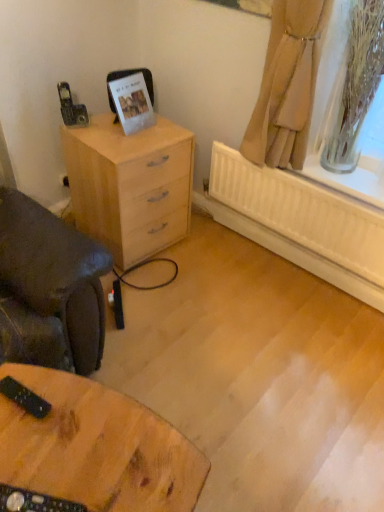
Image resolution: width=384 pixels, height=512 pixels. Describe the element at coordinates (287, 85) in the screenshot. I see `beige fabric curtain at upper right` at that location.

Identify the location of beige fabric curtain at upper right. (287, 85).

Considering the sizes of objects wooden table at lower left and beige fabric curtain at upper right in the image provided, who is bigger, wooden table at lower left or beige fabric curtain at upper right?

Bigger between the two is wooden table at lower left.

Could you tell me if wooden table at lower left is facing beige fabric curtain at upper right?

Answer: No, wooden table at lower left is not oriented towards beige fabric curtain at upper right.

Is wooden table at lower left with beige fabric curtain at upper right?

A: wooden table at lower left and beige fabric curtain at upper right are not in contact.

Between wooden table at lower left and light wood chest of drawers at left, which one has larger width?

wooden table at lower left.

Does wooden table at lower left turn towards light wood chest of drawers at left?

No, wooden table at lower left is not aimed at light wood chest of drawers at left.

From a real-world perspective, relative to light wood chest of drawers at left, is wooden table at lower left vertically above or below?

wooden table at lower left is situated lower than light wood chest of drawers at left in the real world.

Is point (129, 238) in front of point (269, 147)?

No, it is not.

Which object is closer to the camera taking this photo, light wood chest of drawers at left or beige fabric curtain at upper right?

beige fabric curtain at upper right.

Between light wood chest of drawers at left and beige fabric curtain at upper right, which one appears on the left side from the viewer's perspective?

light wood chest of drawers at left is more to the left.

Image resolution: width=384 pixels, height=512 pixels. In the image, there is a beige fabric curtain at upper right. In order to click on the chest of drawers below it (from the image's perspective) in this screenshot , I will do `click(130, 185)`.

From a real-world perspective, is beige fabric curtain at upper right above or below wooden table at lower left?

In terms of real-world spatial position, beige fabric curtain at upper right is above wooden table at lower left.

From the image's perspective, between beige fabric curtain at upper right and wooden table at lower left, which one is located above?

beige fabric curtain at upper right.

How many degrees apart are the facing directions of beige fabric curtain at upper right and wooden table at lower left?

They differ by 74.7 degrees in their facing directions.

Considering the relative sizes of beige fabric curtain at upper right and wooden table at lower left in the image provided, is beige fabric curtain at upper right wider than wooden table at lower left?

No, beige fabric curtain at upper right is not wider than wooden table at lower left.

Is light wood chest of drawers at left shorter than wooden table at lower left?

Incorrect, the height of light wood chest of drawers at left does not fall short of that of wooden table at lower left.

Consider the image. From a real-world perspective, who is located lower, light wood chest of drawers at left or wooden table at lower left?

In real-world perspective, wooden table at lower left is lower.

Which object is more forward, light wood chest of drawers at left or wooden table at lower left?

wooden table at lower left is in front.

Considering the relative positions of beige fabric curtain at upper right and light wood chest of drawers at left in the image provided, is beige fabric curtain at upper right in front of light wood chest of drawers at left?

Yes, beige fabric curtain at upper right is closer to the viewer.

Find the location of a particular element. curtain above the light wood chest of drawers at left (from a real-world perspective) is located at coordinates (x=287, y=85).

Does beige fabric curtain at upper right have a lesser width compared to light wood chest of drawers at left?

Indeed, beige fabric curtain at upper right has a lesser width compared to light wood chest of drawers at left.

From the image's perspective, is beige fabric curtain at upper right positioned above or below light wood chest of drawers at left?

Based on their image positions, beige fabric curtain at upper right is located above light wood chest of drawers at left.

The height and width of the screenshot is (512, 384). I want to click on curtain above the wooden table at lower left (from a real-world perspective), so click(287, 85).

The height and width of the screenshot is (512, 384). What are the coordinates of `table in front of the light wood chest of drawers at left` in the screenshot? It's located at (96, 447).

Considering their positions, is light wood chest of drawers at left positioned closer to beige fabric curtain at upper right than wooden table at lower left?

light wood chest of drawers at left is positioned closer to the anchor beige fabric curtain at upper right.

From the image, which object appears to be farther from beige fabric curtain at upper right, wooden table at lower left or light wood chest of drawers at left?

→ wooden table at lower left lies further to beige fabric curtain at upper right than the other object.

In the scene shown: Looking at the image, which one is located closer to light wood chest of drawers at left, wooden table at lower left or beige fabric curtain at upper right?

beige fabric curtain at upper right.

Estimate the real-world distances between objects in this image. Which object is closer to light wood chest of drawers at left, beige fabric curtain at upper right or wooden table at lower left?

The object closer to light wood chest of drawers at left is beige fabric curtain at upper right.

Looking at the image, which one is located closer to wooden table at lower left, light wood chest of drawers at left or beige fabric curtain at upper right?

Among the two, light wood chest of drawers at left is located nearer to wooden table at lower left.

Based on their spatial positions, is beige fabric curtain at upper right or light wood chest of drawers at left closer to wooden table at lower left?

The object closer to wooden table at lower left is light wood chest of drawers at left.

At what (x,y) coordinates should I click in order to perform the action: click on the chest of drawers between beige fabric curtain at upper right and wooden table at lower left vertically. Please return your answer as a coordinate pair (x, y). Looking at the image, I should click on (130, 185).